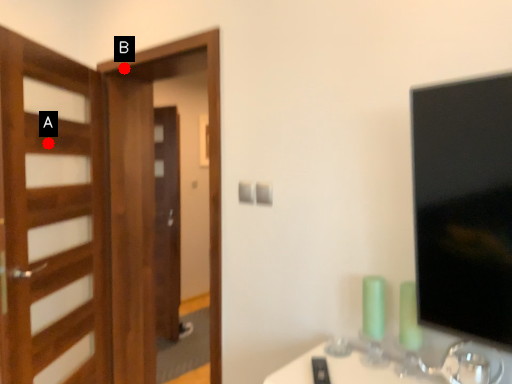
Question: Two points are circled on the image, labeled by A and B beside each circle. Which of the following is the farthest from the observer?

Choices:
 (A) A is further
 (B) B is further

Answer: (B)